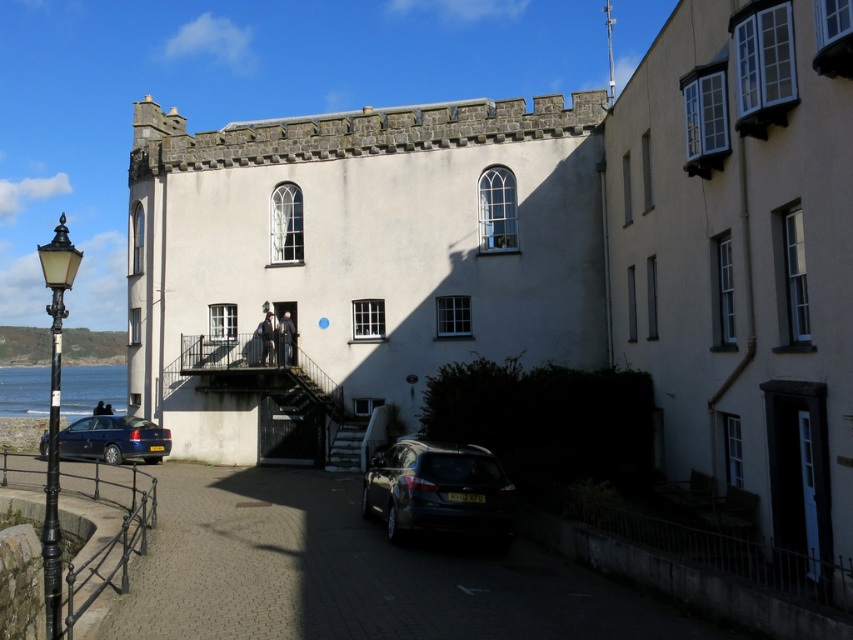
The width and height of the screenshot is (853, 640). Describe the element at coordinates (308, 426) in the screenshot. I see `metallic gray staircase at center` at that location.

Is metallic gray staircase at center further to camera compared to wooden staircase at center?

Yes, it is behind wooden staircase at center.

Who is more forward, (334, 454) or (341, 448)?

Positioned in front is point (341, 448).

This screenshot has height=640, width=853. Find the location of `metallic gray staircase at center`. metallic gray staircase at center is located at coordinates (308, 426).

Who is more distant from viewer, (480, 528) or (276, 435)?

Point (276, 435)

In the scene shown: Which is above, shiny black car at lower center or metallic gray staircase at center?

shiny black car at lower center is above.

Which is behind, point (421, 516) or point (344, 442)?

Positioned behind is point (344, 442).

I want to click on shiny black car at lower center, so tap(439, 492).

Between metallic gray staircase at center and metallic blue hatchback at lower left, which one has less height?

With less height is metallic gray staircase at center.

Image resolution: width=853 pixels, height=640 pixels. What are the coordinates of `metallic gray staircase at center` in the screenshot? It's located at click(308, 426).

What do you see at coordinates (308, 426) in the screenshot? I see `metallic gray staircase at center` at bounding box center [308, 426].

At what (x,y) coordinates should I click in order to perform the action: click on metallic gray staircase at center. Please return your answer as a coordinate pair (x, y). The image size is (853, 640). Looking at the image, I should click on (308, 426).